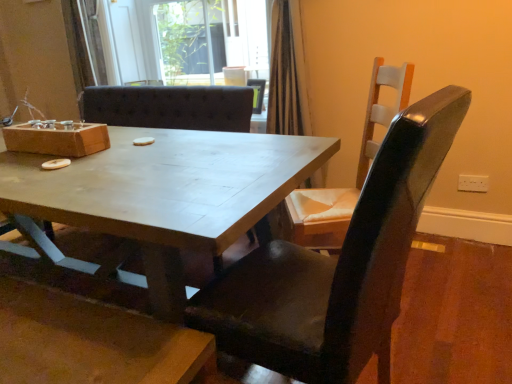
Where is `wooden chair at right, acting as the first chair starting from the back`? The width and height of the screenshot is (512, 384). wooden chair at right, acting as the first chair starting from the back is located at coordinates point(357,171).

What is the approximate height of matte wooden table at center?

29.15 inches.

Find the location of a particular element. matte black chair at center, the second chair positioned from the back is located at coordinates (337, 266).

Would you say wooden box at upper left is a long distance from wooden chair at right, acting as the first chair starting from the back?

Indeed, wooden box at upper left is not near wooden chair at right, acting as the first chair starting from the back.

Between point (93, 139) and point (337, 220), which one is positioned in front?

The point (337, 220) is in front.

From a real-world perspective, is wooden box at upper left on wooden chair at right, acting as the second chair starting from the front?

Yes, from a real-world perspective, wooden box at upper left is above wooden chair at right, acting as the second chair starting from the front.

From the image's perspective, is matte wooden table at center above or below wooden chair at right, acting as the second chair starting from the front?

matte wooden table at center is below wooden chair at right, acting as the second chair starting from the front.

Can you confirm if matte wooden table at center is positioned to the right of wooden chair at right, acting as the first chair starting from the back?

No.

Is point (209, 167) closer or farther from the camera than point (336, 194)?

Point (209, 167) is closer to the camera than point (336, 194).

Could you measure the distance between matte wooden table at center and wooden chair at right, acting as the second chair starting from the front?

They are 22.32 inches apart.

Is transparent glass door at upper center at the left side of matte black chair at center, which appears as the first chair when viewed from the front?

Yes.

Would you say transparent glass door at upper center contains matte black chair at center, the second chair positioned from the back?

Definitely not — matte black chair at center, the second chair positioned from the back, is not inside transparent glass door at upper center.

Is matte black chair at center, the second chair positioned from the back, next to transparent glass door at upper center and touching it?

No.

Is matte black chair at center, the second chair positioned from the back, facing towards transparent glass door at upper center?

No, matte black chair at center, the second chair positioned from the back, is not oriented towards transparent glass door at upper center.

Which is correct: matte black chair at center, the second chair positioned from the back, is inside transparent glass door at upper center, or outside of it?

matte black chair at center, the second chair positioned from the back, is not enclosed by transparent glass door at upper center.

Image resolution: width=512 pixels, height=384 pixels. I want to click on box above the matte black chair at center, which appears as the first chair when viewed from the front (from the image's perspective), so click(x=57, y=139).

From a real-world perspective, does matte black chair at center, which appears as the first chair when viewed from the front, sit lower than wooden box at upper left?

Yes, from a real-world perspective, matte black chair at center, which appears as the first chair when viewed from the front, is under wooden box at upper left.

Considering the sizes of objects matte black chair at center, the second chair positioned from the back, and wooden box at upper left in the image provided, who is wider, matte black chair at center, the second chair positioned from the back, or wooden box at upper left?

matte black chair at center, the second chair positioned from the back.

Who is bigger, matte black chair at center, which appears as the first chair when viewed from the front, or matte wooden table at center?

With larger size is matte wooden table at center.

Is point (238, 300) positioned before point (268, 171)?

Yes.

Does matte black chair at center, the second chair positioned from the back, touch matte wooden table at center?

No, matte black chair at center, the second chair positioned from the back, is not in contact with matte wooden table at center.

From the image's perspective, between matte black chair at center, the second chair positioned from the back, and matte wooden table at center, who is located below?

From the image's view, matte black chair at center, the second chair positioned from the back, is below.

Can you confirm if wooden chair at right, acting as the first chair starting from the back, is smaller than wooden box at upper left?

Actually, wooden chair at right, acting as the first chair starting from the back, might be larger than wooden box at upper left.

Could you tell me if wooden chair at right, acting as the second chair starting from the front, is turned towards wooden box at upper left?

Yes, wooden chair at right, acting as the second chair starting from the front, is facing wooden box at upper left.

I want to click on chair that is the 1st object located below the wooden box at upper left (from the image's perspective), so click(357, 171).

You are a GUI agent. You are given a task and a screenshot of the screen. Output one action in this format:
    pyautogui.click(x=<x>, y=<y>)
    Task: Click on the coffee table in front of the wooden chair at right, acting as the first chair starting from the back
    The image size is (512, 384).
    Given the screenshot: What is the action you would take?
    pyautogui.click(x=163, y=194)

Looking at the image, which one is located further to wooden chair at right, acting as the first chair starting from the back, matte black chair at center, which appears as the first chair when viewed from the front, or wooden box at upper left?

wooden box at upper left.

Looking at the image, which one is located closer to transparent glass door at upper center, matte black chair at center, the second chair positioned from the back, or wooden chair at right, acting as the first chair starting from the back?

wooden chair at right, acting as the first chair starting from the back.

Based on their spatial positions, is transparent glass door at upper center or wooden chair at right, acting as the second chair starting from the front, further from matte wooden table at center?

transparent glass door at upper center is further to matte wooden table at center.

From the image, which object appears to be farther from wooden box at upper left, transparent glass door at upper center or wooden chair at right, acting as the second chair starting from the front?

Based on the image, transparent glass door at upper center appears to be further to wooden box at upper left.

Looking at this image, looking at the image, which one is located closer to wooden box at upper left, transparent glass door at upper center or matte wooden table at center?

Based on the image, matte wooden table at center appears to be nearer to wooden box at upper left.

Looking at the image, which one is located further to matte black chair at center, which appears as the first chair when viewed from the front, transparent glass door at upper center or matte wooden table at center?

Based on the image, transparent glass door at upper center appears to be further to matte black chair at center, which appears as the first chair when viewed from the front.

Estimate the real-world distances between objects in this image. Which object is further from matte wooden table at center, transparent glass door at upper center or matte black chair at center, the second chair positioned from the back?

transparent glass door at upper center lies further to matte wooden table at center than the other object.

Which object lies further to the anchor point wooden chair at right, acting as the second chair starting from the front, transparent glass door at upper center or wooden box at upper left?

transparent glass door at upper center is further to wooden chair at right, acting as the second chair starting from the front.

Identify the location of coffee table located between wooden box at upper left and matte black chair at center, the second chair positioned from the back, in the left-right direction. (163, 194).

Find the location of `chair between matte wooden table at center and transparent glass door at upper center in the front-back direction`. chair between matte wooden table at center and transparent glass door at upper center in the front-back direction is located at coordinates (357, 171).

You are a GUI agent. You are given a task and a screenshot of the screen. Output one action in this format:
    pyautogui.click(x=<x>, y=<y>)
    Task: Click on the chair between wooden box at upper left and wooden chair at right, acting as the first chair starting from the back, from left to right
    This screenshot has width=512, height=384.
    Given the screenshot: What is the action you would take?
    (337, 266)

Where is `glass door situated between wooden box at upper left and wooden chair at right, acting as the first chair starting from the back, from left to right`? The image size is (512, 384). glass door situated between wooden box at upper left and wooden chair at right, acting as the first chair starting from the back, from left to right is located at coordinates (179, 43).